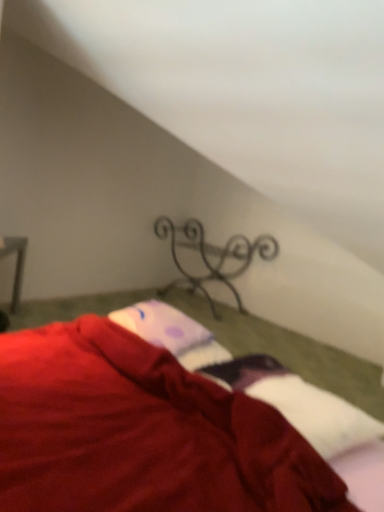
What is the approximate width of purple dotted fabric at center?

The width of purple dotted fabric at center is 15.28 inches.

I want to click on purple dotted fabric at center, so click(162, 326).

Based on the photo, which point is more distant from viewer, (x=239, y=236) or (x=112, y=316)?

The point (x=239, y=236) is farther.

Considering their positions, is metallic wrought iron at center located in front of or behind purple dotted fabric at center?

In the image, metallic wrought iron at center appears behind purple dotted fabric at center.

Between metallic wrought iron at center and purple dotted fabric at center, which one has smaller width?

purple dotted fabric at center is thinner.

Is purple dotted fabric at center inside metallic wrought iron at center?

That's incorrect, purple dotted fabric at center is not inside metallic wrought iron at center.

Is metallic wrought iron at center closer to the viewer compared to velvet red blanket at lower center?

No.

Is the surface of metallic wrought iron at center in direct contact with velvet red blanket at lower center?

No, metallic wrought iron at center is not touching velvet red blanket at lower center.

From the picture: Visually, is metallic wrought iron at center positioned to the left or to the right of velvet red blanket at lower center?

Answer: In the image, metallic wrought iron at center appears on the right side of velvet red blanket at lower center.

Considering the sizes of objects metallic wrought iron at center and velvet red blanket at lower center in the image provided, who is shorter, metallic wrought iron at center or velvet red blanket at lower center?

velvet red blanket at lower center is shorter.

Is purple dotted fabric at center oriented away from velvet red blanket at lower center?

Yes, velvet red blanket at lower center is at the back of purple dotted fabric at center.

Considering the sizes of purple dotted fabric at center and velvet red blanket at lower center in the image, is purple dotted fabric at center taller or shorter than velvet red blanket at lower center?

purple dotted fabric at center is shorter than velvet red blanket at lower center.

From the image's perspective, who appears lower, purple dotted fabric at center or velvet red blanket at lower center?

velvet red blanket at lower center is shown below in the image.

What's the angular difference between purple dotted fabric at center and velvet red blanket at lower center's facing directions?

The angular difference between purple dotted fabric at center and velvet red blanket at lower center is 88.9 degrees.

Considering the sizes of velvet red blanket at lower center and metallic wrought iron at center in the image, is velvet red blanket at lower center wider or thinner than metallic wrought iron at center?

In the image, velvet red blanket at lower center appears to be wider than metallic wrought iron at center.

From the image's perspective, which one is positioned higher, velvet red blanket at lower center or metallic wrought iron at center?

metallic wrought iron at center, from the image's perspective.

The height and width of the screenshot is (512, 384). What are the coordinates of `design on the right of velvet red blanket at lower center` in the screenshot? It's located at (212, 257).

Is velvet red blanket at lower center looking in the opposite direction of metallic wrought iron at center?

Correct, velvet red blanket at lower center is looking away from metallic wrought iron at center.

Which of these two, purple dotted fabric at center or metallic wrought iron at center, is bigger?

With larger size is metallic wrought iron at center.

Is purple dotted fabric at center facing towards metallic wrought iron at center?

No.

Measure the distance between purple dotted fabric at center and metallic wrought iron at center.

5.54 feet.

Considering the relative sizes of purple dotted fabric at center and metallic wrought iron at center in the image provided, is purple dotted fabric at center thinner than metallic wrought iron at center?

Correct, the width of purple dotted fabric at center is less than that of metallic wrought iron at center.

Can you confirm if velvet red blanket at lower center is bigger than purple dotted fabric at center?

Correct, velvet red blanket at lower center is larger in size than purple dotted fabric at center.

At what (x,y) coordinates should I click in order to perform the action: click on pillow on the left of velvet red blanket at lower center. Please return your answer as a coordinate pair (x, y). Looking at the image, I should click on (162, 326).

Is velvet red blanket at lower center in front of or behind purple dotted fabric at center in the image?

Visually, velvet red blanket at lower center is located in front of purple dotted fabric at center.

At what (x,y) coordinates should I click in order to perform the action: click on pillow below the metallic wrought iron at center (from the image's perspective). Please return your answer as a coordinate pair (x, y). The height and width of the screenshot is (512, 384). Looking at the image, I should click on (162, 326).

Find the location of a particular element. Image resolution: width=384 pixels, height=512 pixels. design above the velvet red blanket at lower center (from a real-world perspective) is located at coordinates (212, 257).

Based on their spatial positions, is purple dotted fabric at center or metallic wrought iron at center further from velvet red blanket at lower center?

The object further to velvet red blanket at lower center is metallic wrought iron at center.

Looking at the image, which one is located closer to purple dotted fabric at center, velvet red blanket at lower center or metallic wrought iron at center?

Among the two, velvet red blanket at lower center is located nearer to purple dotted fabric at center.

From the picture: Considering their positions, is purple dotted fabric at center positioned closer to metallic wrought iron at center than velvet red blanket at lower center?

The object closer to metallic wrought iron at center is purple dotted fabric at center.

Based on the photo, which object lies nearer to the anchor point velvet red blanket at lower center, metallic wrought iron at center or purple dotted fabric at center?

purple dotted fabric at center is positioned closer to the anchor velvet red blanket at lower center.

When comparing their distances from purple dotted fabric at center, does metallic wrought iron at center or velvet red blanket at lower center seem closer?

velvet red blanket at lower center is closer to purple dotted fabric at center.

From the image, which object appears to be farther from metallic wrought iron at center, velvet red blanket at lower center or purple dotted fabric at center?

Among the two, velvet red blanket at lower center is located further to metallic wrought iron at center.

Locate an element on the screen. The image size is (384, 512). pillow between velvet red blanket at lower center and metallic wrought iron at center in the front-back direction is located at coordinates (162, 326).